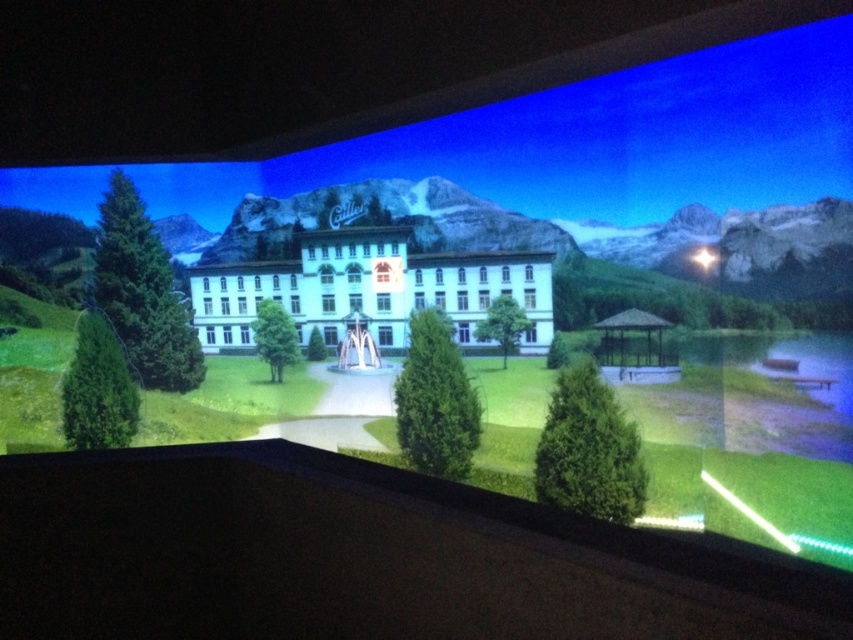
You are standing in front of the digitally projected scene and notice the green grassy golf course at center and the white glossy building at center. Based on the projection, which object is positioned to the right of the other?

The green grassy golf course at center is to the right of the white glossy building at center.

You are a landscape architect evaluating the projected design. Which object among the green grassy golf course at center and the white glossy mountain at center occupies a larger area in the image?

The white glossy mountain at center occupies a larger area in the image compared to the green grassy golf course at center, as the green grassy golf course at center has a smaller size compared to the white glossy mountain at center.